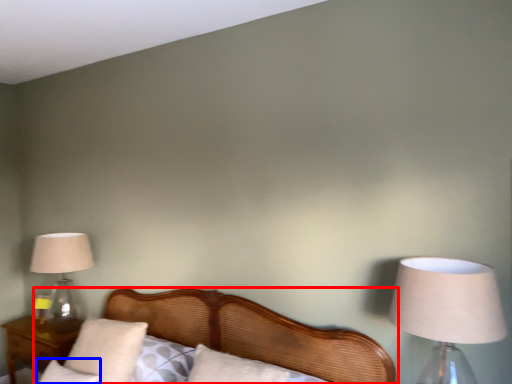
Question: Which of the following is the closest to the observer, bed (highlighted by a red box) or pillow (highlighted by a blue box)?

Choices:
 (A) bed
 (B) pillow

Answer: (A)